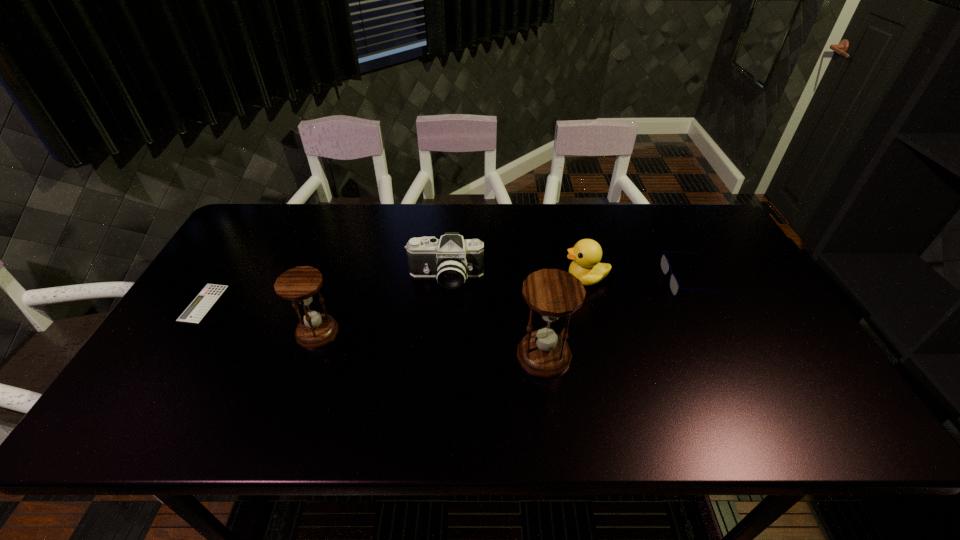
The height and width of the screenshot is (540, 960). I want to click on free space between the second shortest object and the shortest object, so click(x=447, y=293).

Locate an element on the screen. Image resolution: width=960 pixels, height=540 pixels. free space between the taller hourglass and the fifth object from right to left is located at coordinates [x=431, y=343].

Where is `free space between the left hourglass and the duck`? Image resolution: width=960 pixels, height=540 pixels. free space between the left hourglass and the duck is located at coordinates (451, 305).

Where is `vacant region between the shorter hourglass and the spectacles`? vacant region between the shorter hourglass and the spectacles is located at coordinates (505, 307).

Find the location of a particular element. Image resolution: width=960 pixels, height=540 pixels. unoccupied area between the tallest object and the rightmost object is located at coordinates (618, 319).

The height and width of the screenshot is (540, 960). I want to click on vacant point located between the third object from right to left and the shortest object, so click(x=373, y=329).

At what (x,y) coordinates should I click in order to perform the action: click on free space that is in between the fifth shortest object and the camera. Please return your answer as a coordinate pair (x, y). The height and width of the screenshot is (540, 960). Looking at the image, I should click on (382, 305).

At what (x,y) coordinates should I click in order to perform the action: click on free space between the shorter hourglass and the fifth object from left to right. Please return your answer as a coordinate pair (x, y). Looking at the image, I should click on [451, 305].

Where is `unoccupied position between the fourth object from right to left and the tallest object`? Image resolution: width=960 pixels, height=540 pixels. unoccupied position between the fourth object from right to left and the tallest object is located at coordinates (494, 316).

Locate an element on the screen. The image size is (960, 540). object that is the third closest to the calculator is located at coordinates (552, 293).